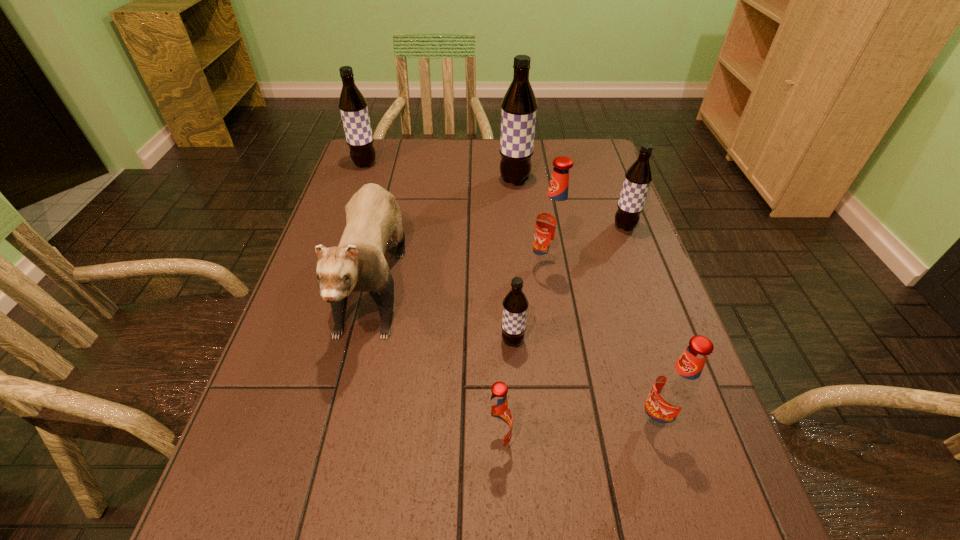
Identify the location of vacant position located 0.120m on the left of the rightmost red root beer. Image resolution: width=960 pixels, height=540 pixels. (572, 424).

What are the coordinates of `free location located on the right of the smallest brown root beer` in the screenshot? It's located at (654, 341).

The height and width of the screenshot is (540, 960). In order to click on vacant space located 0.060m on the left of the leftmost red root beer in this screenshot , I will do `click(448, 443)`.

Locate an element on the screen. Image resolution: width=960 pixels, height=540 pixels. root beer that is at the left edge is located at coordinates (353, 107).

You are a GUI agent. You are given a task and a screenshot of the screen. Output one action in this format:
    pyautogui.click(x=<x>, y=<y>)
    Task: Click on the ferret that is at the left edge
    
    Given the screenshot: What is the action you would take?
    pyautogui.click(x=373, y=216)

Locate an element on the screen. object that is at the far left corner is located at coordinates (353, 107).

In order to click on free location at the far edge of the desktop in this screenshot , I will do `click(452, 145)`.

Where is `vacant space at the left edge of the desktop`? The width and height of the screenshot is (960, 540). vacant space at the left edge of the desktop is located at coordinates click(210, 526).

The image size is (960, 540). What are the coordinates of `vacant space at the right edge` in the screenshot? It's located at (615, 333).

The image size is (960, 540). What are the coordinates of `free region at the far right corner of the desktop` in the screenshot? It's located at (614, 172).